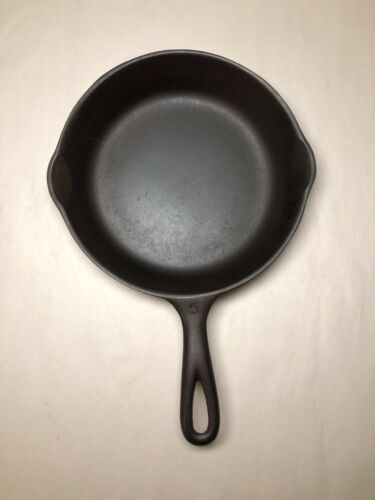
I want to click on handle, so click(x=196, y=365).